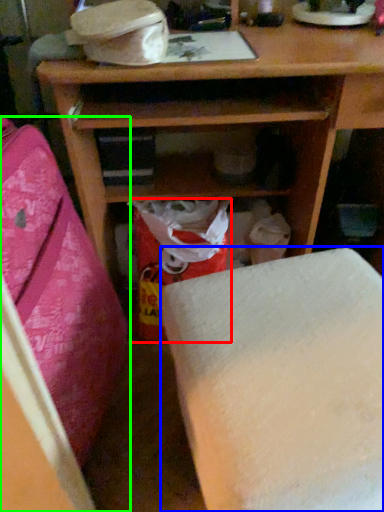
Question: Which object is positioned farthest from shopping bag (highlighted by a red box)? Select from furniture (highlighted by a blue box) and furniture (highlighted by a green box).

Choices:
 (A) furniture
 (B) furniture

Answer: (A)